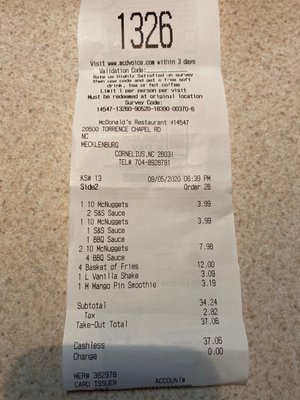
The height and width of the screenshot is (400, 300). Find the location of `counter`. counter is located at coordinates (55, 185).